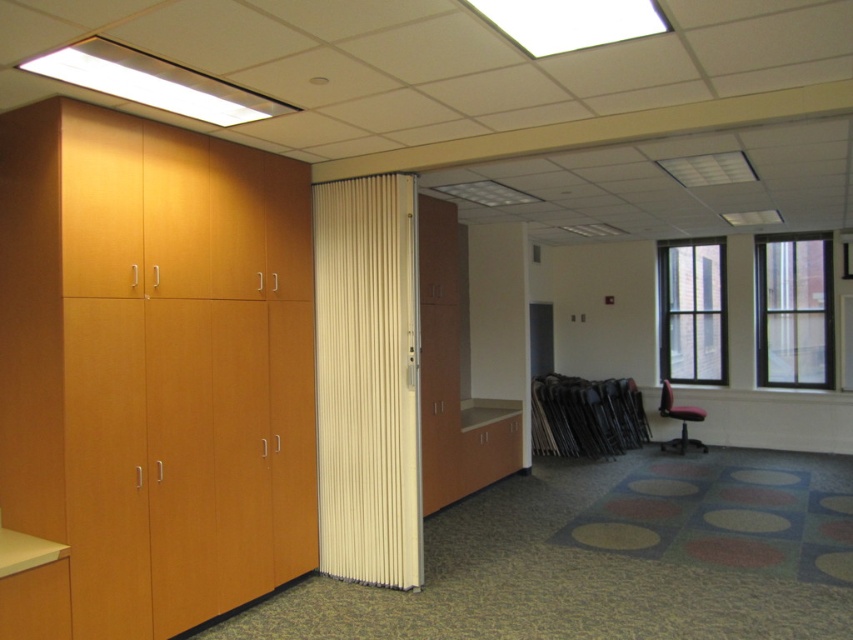
Consider the image. You are an office worker who needs to hang a 1.5 meter tall poster on the wall. You see the matte wood cabinet at left and the white fabric curtain at center. Which object should you choose to hang the poster on so it fits vertically without going over the top?

The matte wood cabinet at left has a greater height compared to the white fabric curtain at center, so you should hang the poster on the matte wood cabinet at left since it can accommodate the 1.5 meter tall poster vertically.

In the scene shown: You are sitting in the red fabric chair at right and want to reach the white fabric curtain at center. Which direction should you move to get closer to the curtain?

Since the white fabric curtain at center is closer to the viewer than the red fabric chair at right, you should move forward towards the curtain to get closer.